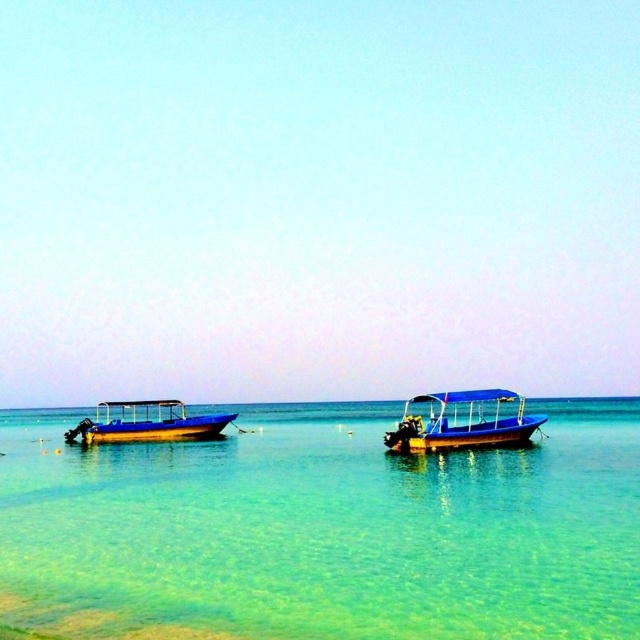
Who is positioned more to the right, clear water at center or blue glossy boat at left?

Positioned to the right is clear water at center.

How distant is clear water at center from blue glossy boat at left?

The distance of clear water at center from blue glossy boat at left is 8.70 meters.

The image size is (640, 640). Describe the element at coordinates (324, 529) in the screenshot. I see `clear water at center` at that location.

The height and width of the screenshot is (640, 640). Find the location of `clear water at center`. clear water at center is located at coordinates (324, 529).

Can you confirm if clear water at center is bigger than blue plastic boat at center?

Yes.

Between clear water at center and blue plastic boat at center, which one is positioned lower?

clear water at center

Describe the element at coordinates (324, 529) in the screenshot. The image size is (640, 640). I see `clear water at center` at that location.

The width and height of the screenshot is (640, 640). Identify the location of clear water at center. (324, 529).

Is blue plastic boat at center wider than blue glossy boat at left?

No.

Is blue plastic boat at center further to the viewer compared to blue glossy boat at left?

No.

This screenshot has height=640, width=640. Find the location of `blue plastic boat at center`. blue plastic boat at center is located at coordinates (461, 422).